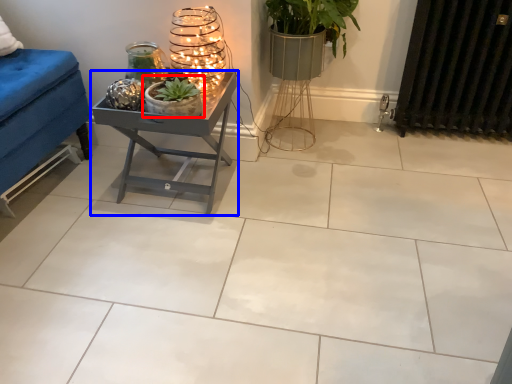
Question: Which of the following is the farthest to the observer, houseplant (highlighted by a red box) or table (highlighted by a blue box)?

Choices:
 (A) houseplant
 (B) table

Answer: (B)